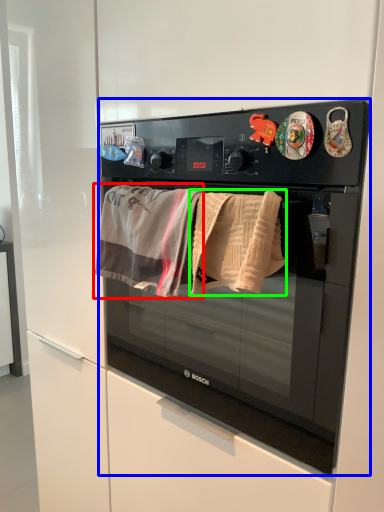
Question: Considering the real-world distances, which object is farthest from beach towel (highlighted by a red box)? microwave oven (highlighted by a blue box) or beach towel (highlighted by a green box)?

Choices:
 (A) microwave oven
 (B) beach towel

Answer: (A)